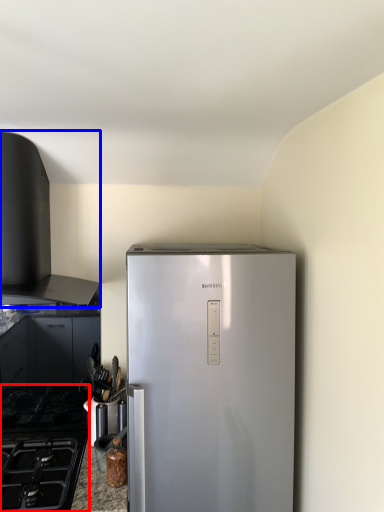
Question: Which point is further to the camera, gas stove (highlighted by a red box) or vent (highlighted by a blue box)?

Choices:
 (A) gas stove
 (B) vent

Answer: (B)